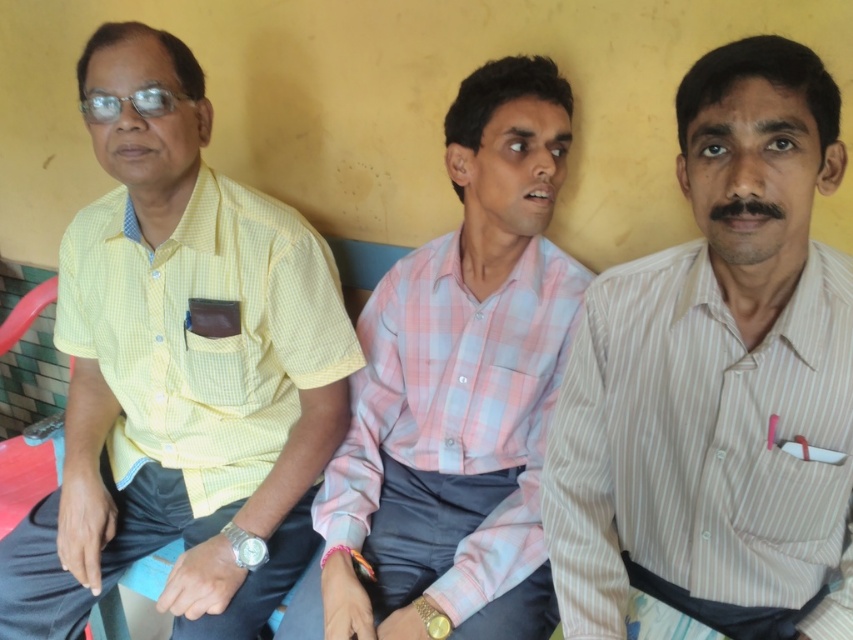
You are standing in front of a group of three men seated against a yellow wall. You need to hand a document to the man wearing the yellow checkered shirt at left. Considering your height is 1.70 meters, will you be able to reach him without moving closer?

The yellow checkered shirt at left is 1.20 meters away from you. Since the distance is within a typical reaching range, you can likely extend your arm to hand the document without needing to move closer.

You are standing in front of the image and want to touch the two points mentioned. Which point is closer to you, point (x=265, y=412) or point (x=786, y=515)?

Point (x=265, y=412) is closer to you than point (x=786, y=515).

You are standing in front of the three men against the yellow wall. You need to hand a document to the person wearing the white striped shirt at center and the pink checkered shirt at center. Which one should you approach first based on their positions?

The white striped shirt at center is closer to the viewer than the pink checkered shirt at center, so you should approach the white striped shirt at center first.